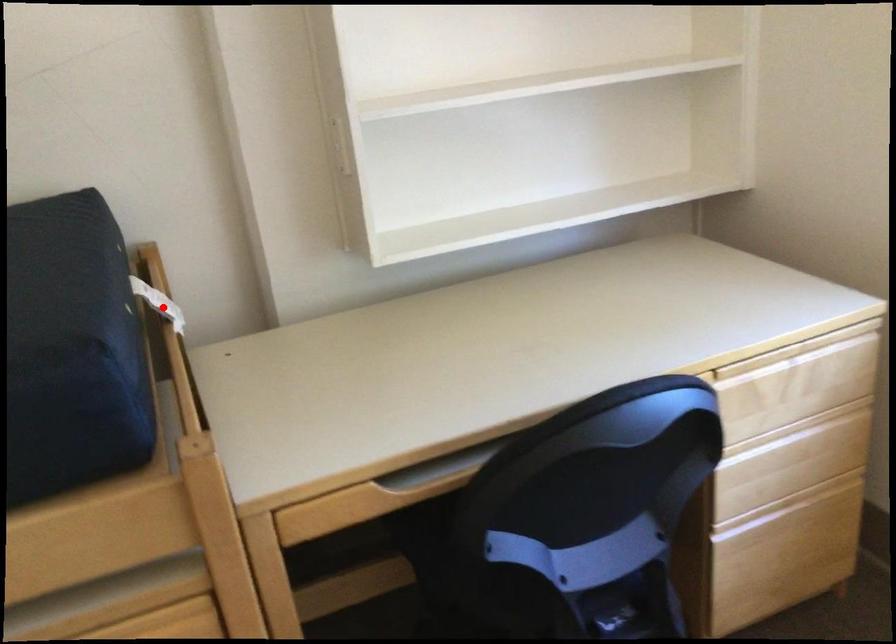
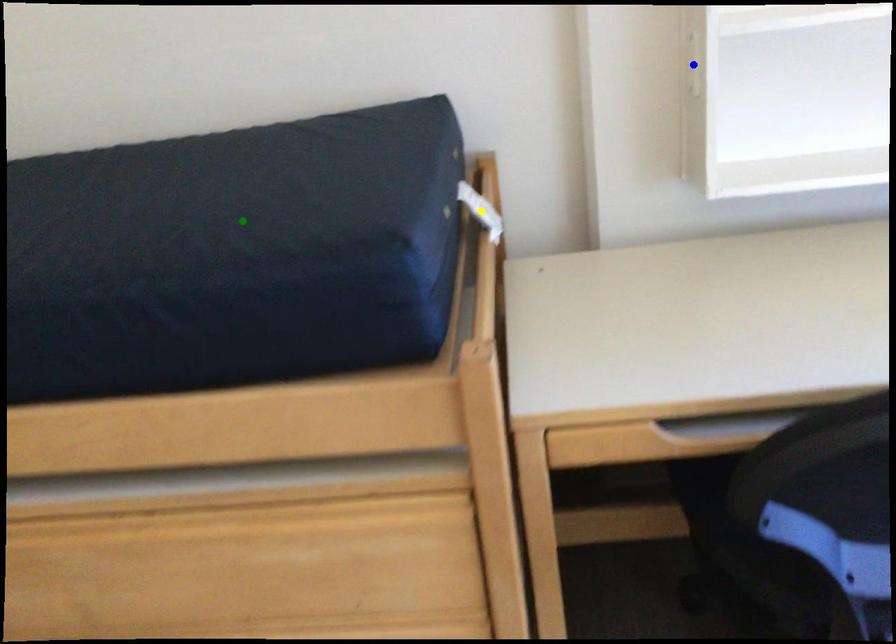
Question: I am providing you with two images of the same scene from different viewpoints. A red point is marked on the first image. You are given multiple points on the second image. Which point in image 2 is actually the same real-world point as the red point in image 1?

Choices:
 (A) green point
 (B) yellow point
 (C) blue point

Answer: (B)